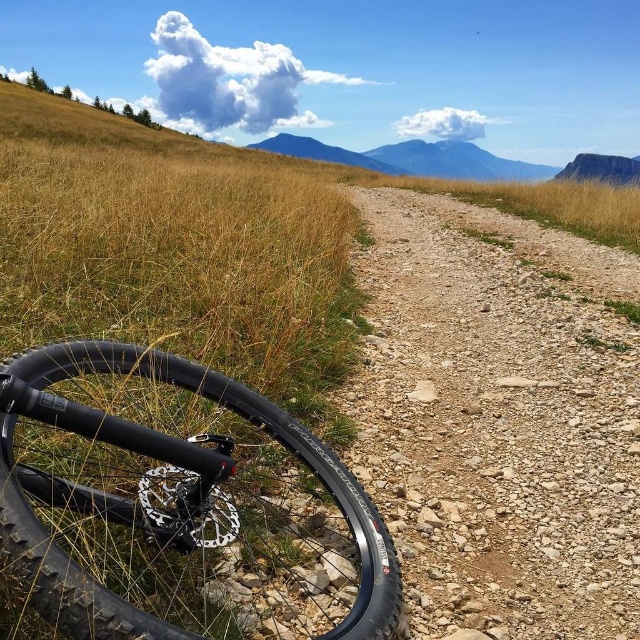
You are a hiker planning to walk from the black rubber tire at lower left to the dusty gravel path at center. Which direction should you move to reach the path?

The dusty gravel path at center is further to the viewer than the black rubber tire at lower left, so you should move backward to reach the path.

You are a hiker carrying a backpack and need to cross the path. The dusty gravel path at center is your only route. Given that your backpack is as wide as the black rubber tire at lower left, will you fit through the path?

The dusty gravel path at center is wider than the black rubber tire at lower left, so yes, the backpack will fit through the path since the path is wider than the tire, and the backpack is as wide as the tire.

You are standing at the starting point of the dusty gravel path at center. If you walk straight ahead, will you eventually reach the bicycle tire resting on the grass beside the path?

The dusty gravel path at center is located at point (499, 419), so walking straight ahead along the path would not lead you to the bicycle tire resting on the grass beside the path since the tire is positioned next to the path, not along its direction.